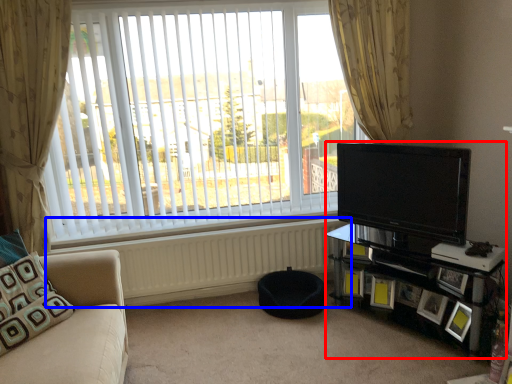
Question: Which object is closer to the camera taking this photo, entertainment center (highlighted by a red box) or radiator (highlighted by a blue box)?

Choices:
 (A) entertainment center
 (B) radiator

Answer: (A)